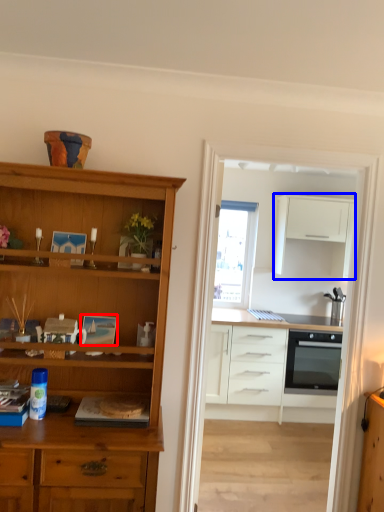
Question: Which of the following is the farthest to the observer, picture frame (highlighted by a red box) or cabinetry (highlighted by a blue box)?

Choices:
 (A) picture frame
 (B) cabinetry

Answer: (B)